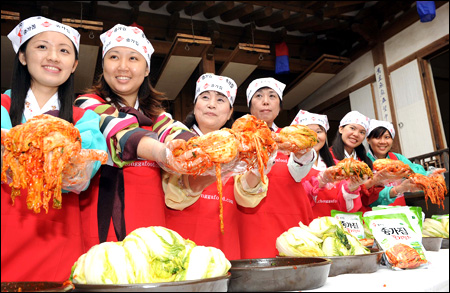
Identify the location of door entry way. The image size is (450, 293). (436, 80).